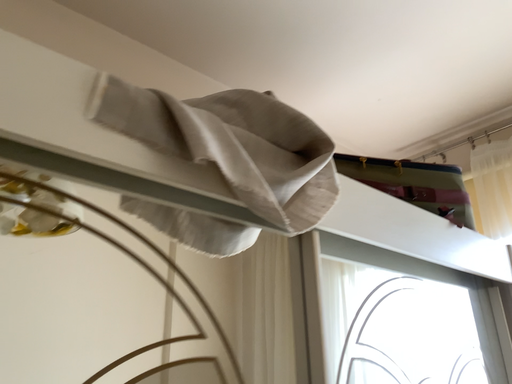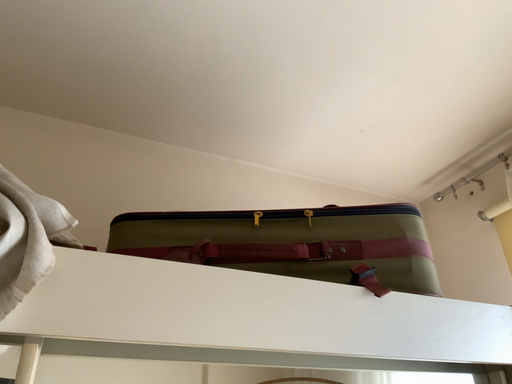
Question: Which way did the camera rotate in the video?

Choices:
 (A) rotated right
 (B) rotated left

Answer: (B)